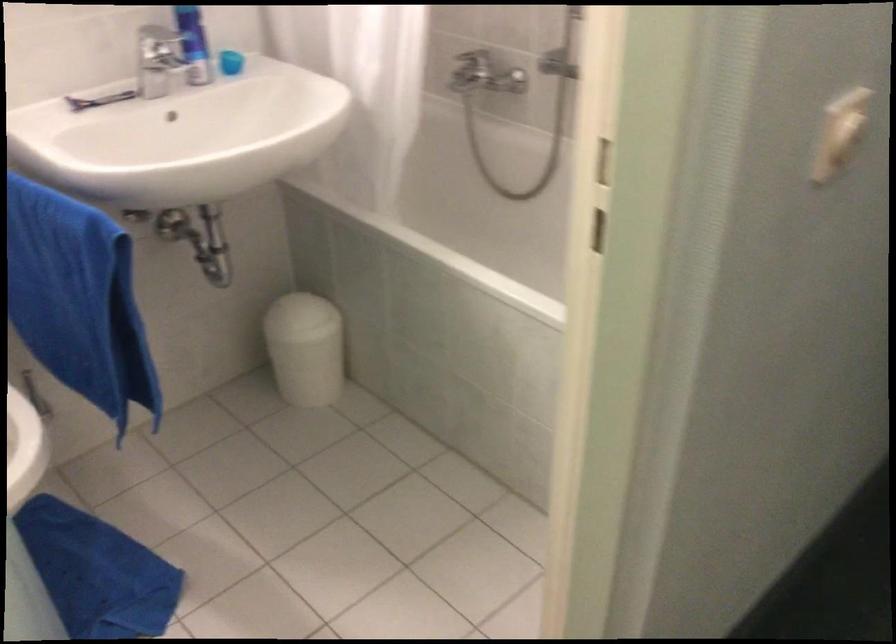
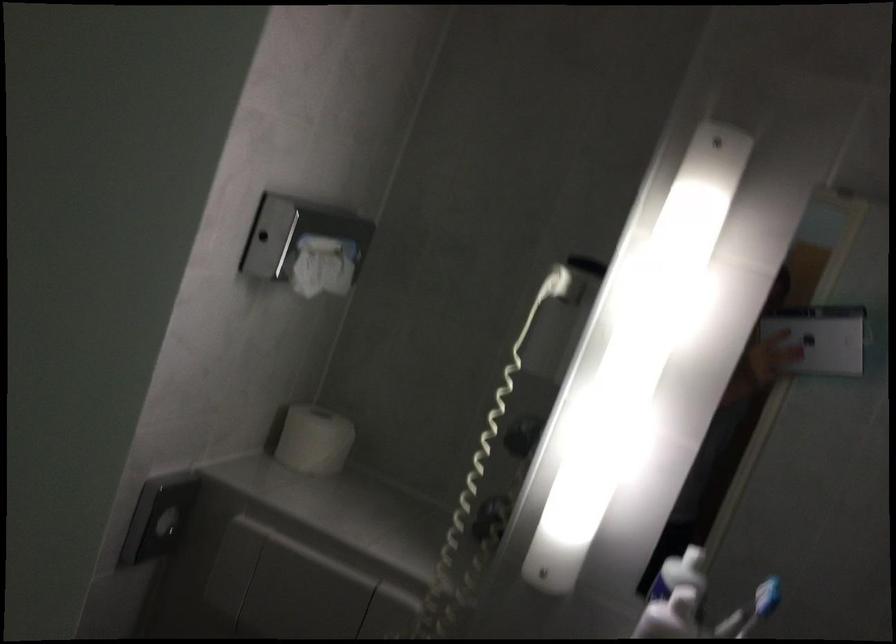
Question: The camera is either moving clockwise (left) or counter-clockwise (right) around the object. The first image is from the beginning of the video and the second image is from the end. Is the camera moving left or right when shooting the video?

Choices:
 (A) Left
 (B) Right

Answer: (B)